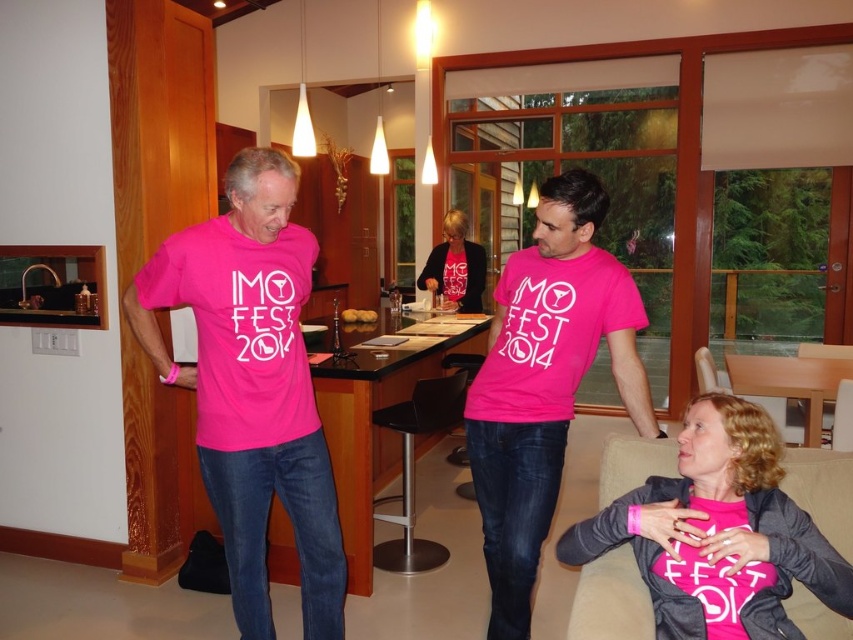
Can you confirm if pink matte t-shirt at left is positioned below pink jersey at center?

Correct, pink matte t-shirt at left is located below pink jersey at center.

Is point (297, 282) less distant than point (442, 292)?

Yes, point (297, 282) is in front of point (442, 292).

You are a GUI agent. You are given a task and a screenshot of the screen. Output one action in this format:
    pyautogui.click(x=<x>, y=<y>)
    Task: Click on the pink matte t-shirt at left
    The width and height of the screenshot is (853, 640).
    Given the screenshot: What is the action you would take?
    pyautogui.click(x=252, y=385)

Is pink matte shirt at center smaller than pink jersey at center?

Yes, pink matte shirt at center is smaller than pink jersey at center.

At what (x,y) coordinates should I click in order to perform the action: click on pink matte shirt at center. Please return your answer as a coordinate pair (x, y). This screenshot has width=853, height=640. Looking at the image, I should click on (718, 531).

Measure the distance between pink matte t-shirt at left and pink matte shirt at center.

pink matte t-shirt at left is 3.62 feet from pink matte shirt at center.

Which of these two, pink matte t-shirt at left or pink matte shirt at center, stands taller?

Standing taller between the two is pink matte t-shirt at left.

This screenshot has height=640, width=853. What do you see at coordinates (252, 385) in the screenshot?
I see `pink matte t-shirt at left` at bounding box center [252, 385].

The width and height of the screenshot is (853, 640). Find the location of `pink matte t-shirt at left`. pink matte t-shirt at left is located at coordinates (252, 385).